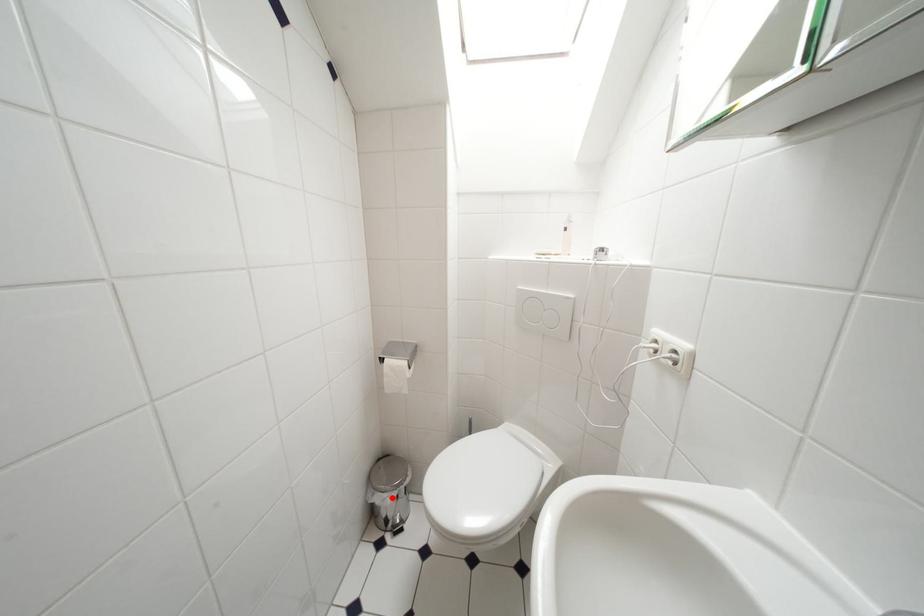
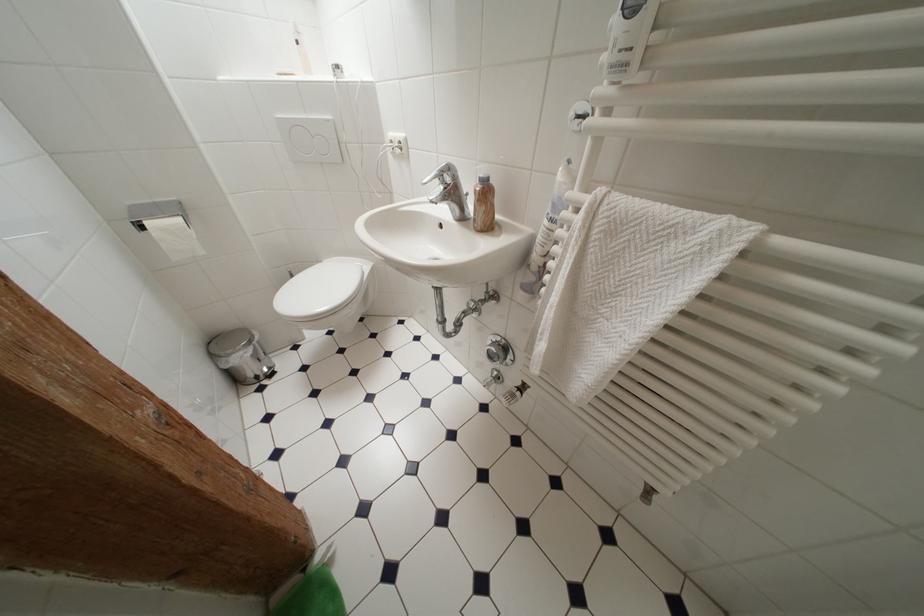
Question: I am providing you with two images of the same scene from different viewpoints. In image1, a red point is highlighted. Considering the same 3D point in image2, which of the following is correct?

Choices:
 (A) It is closer
 (B) It is farther

Answer: (A)